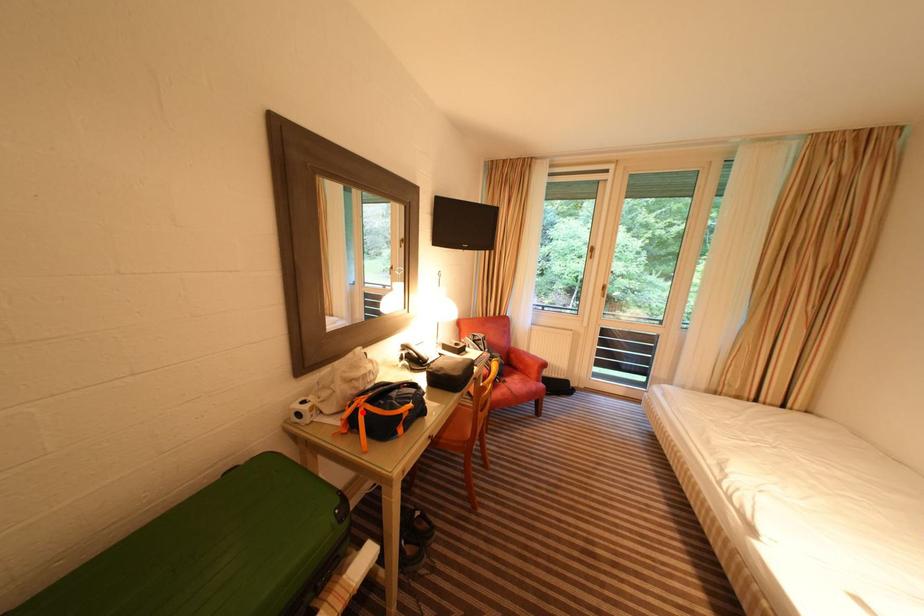
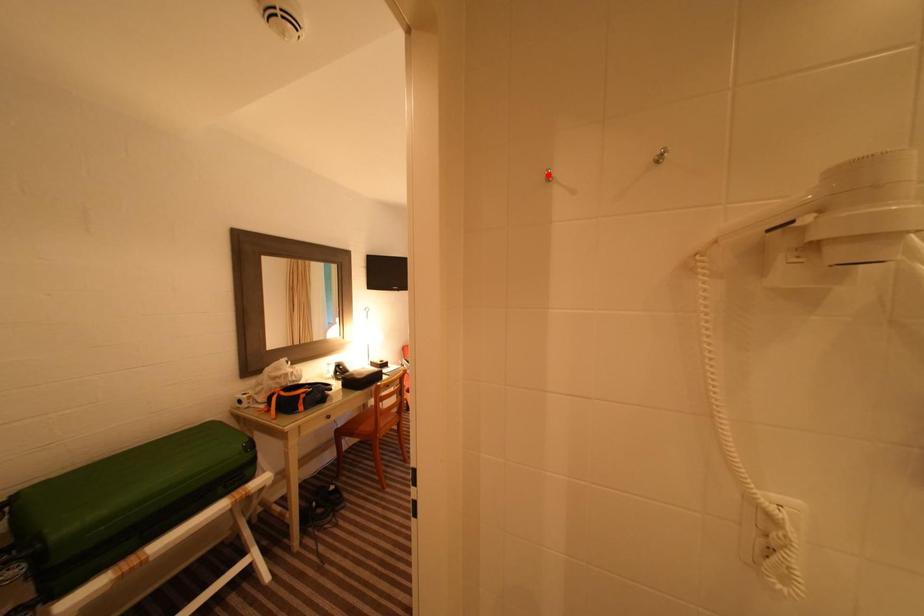
I am providing you with two images of the same scene from different viewpoints. A red point is marked on the first image and another point is marked on the second image. Is the red point in image1 aligned with the point shown in image2?

No